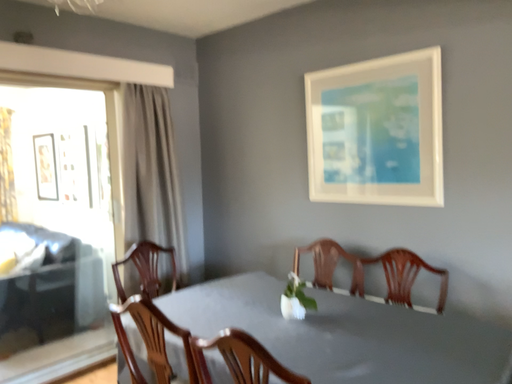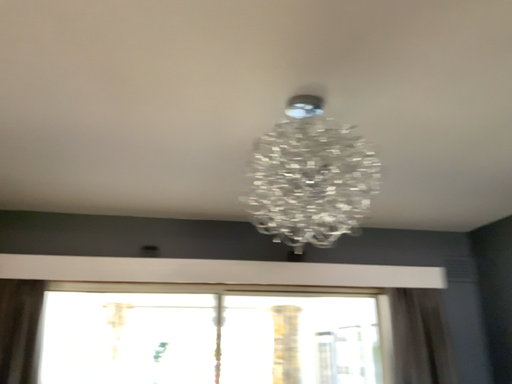
Question: Which way did the camera rotate in the video?

Choices:
 (A) rotated left
 (B) rotated right

Answer: (A)